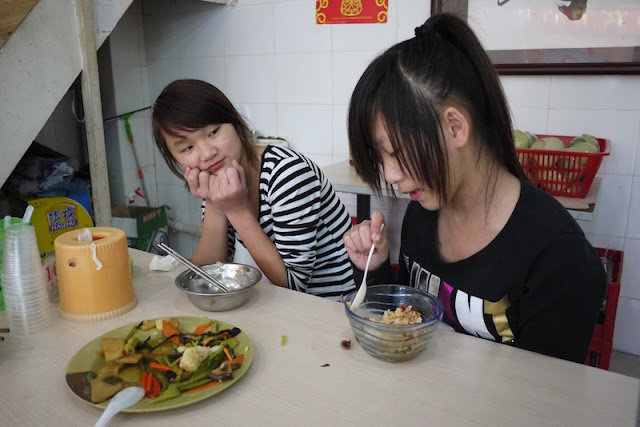
Find the location of a particular element. Image resolution: width=640 pixels, height=427 pixels. stack of plastic cups is located at coordinates (22, 293).